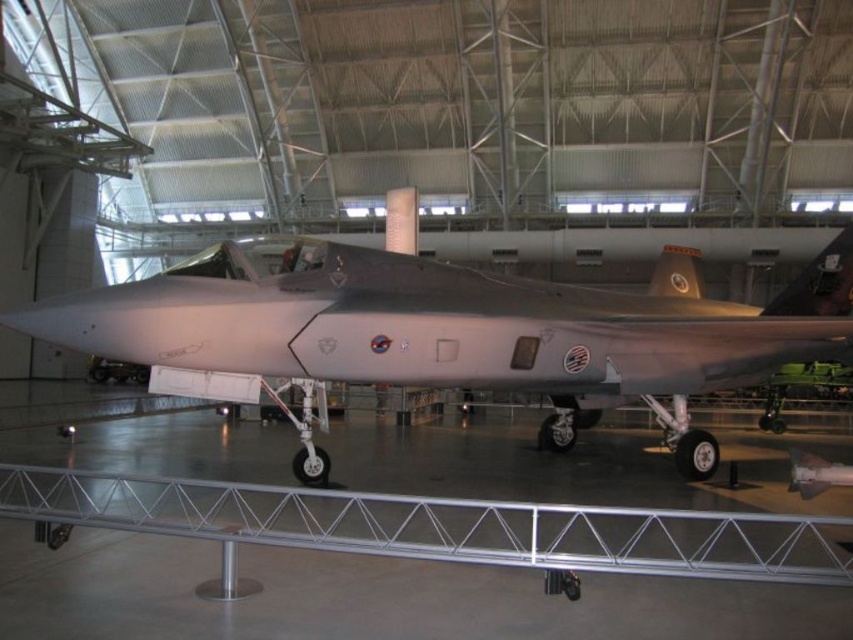
You are a museum guide explaining the layout of the hangar. Where is the matte gray airplane at center positioned in relation to the hangar entrance?

The matte gray airplane at center is positioned at coordinates point (x=453, y=324), so it is centrally located in the hangar, likely facing the entrance for optimal display.

You are standing in front of the stealth fighter jet in the museum. You notice a point marked at coordinates point (780, 296). If you want to touch this point without moving your feet, is it within your reach? Assume your maximum reach is 2 meters.

The point (780, 296) is 8.76 meters away from the camera, which is much farther than your 2 meter reach. Therefore, you cannot reach it without moving.